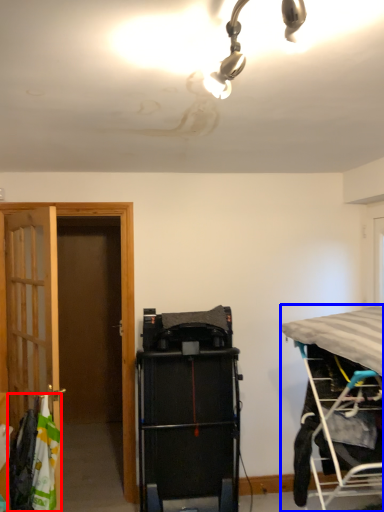
Question: Which point is closer to the camera, laundry (highlighted by a red box) or bed (highlighted by a blue box)?

Choices:
 (A) laundry
 (B) bed

Answer: (B)